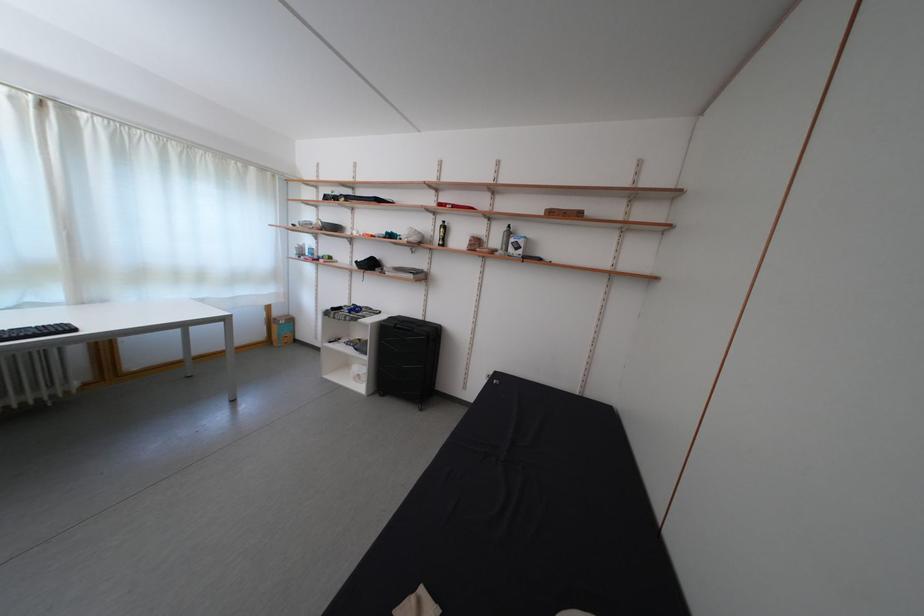
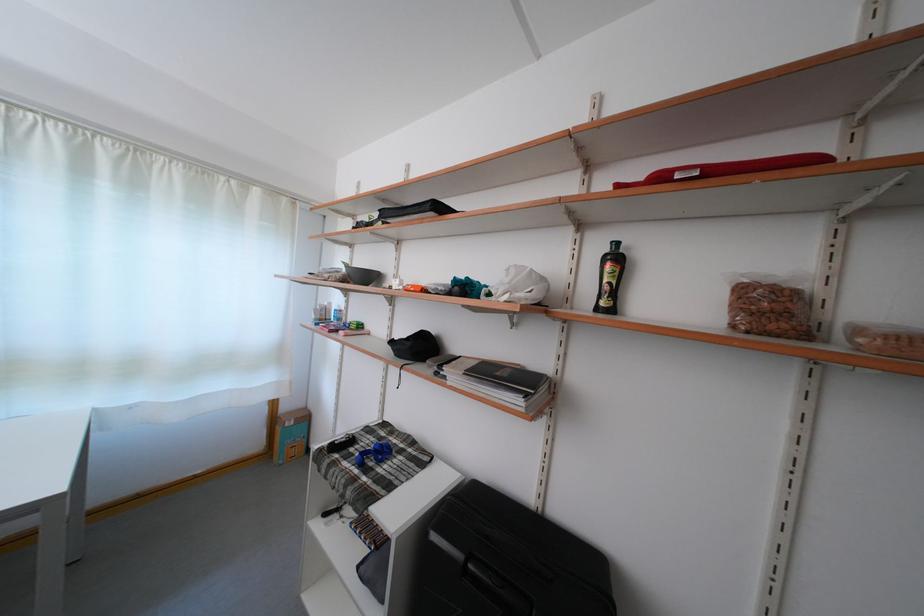
Locate, in the second image, the point that corresponds to pixel 420 282 in the first image.

(527, 408)